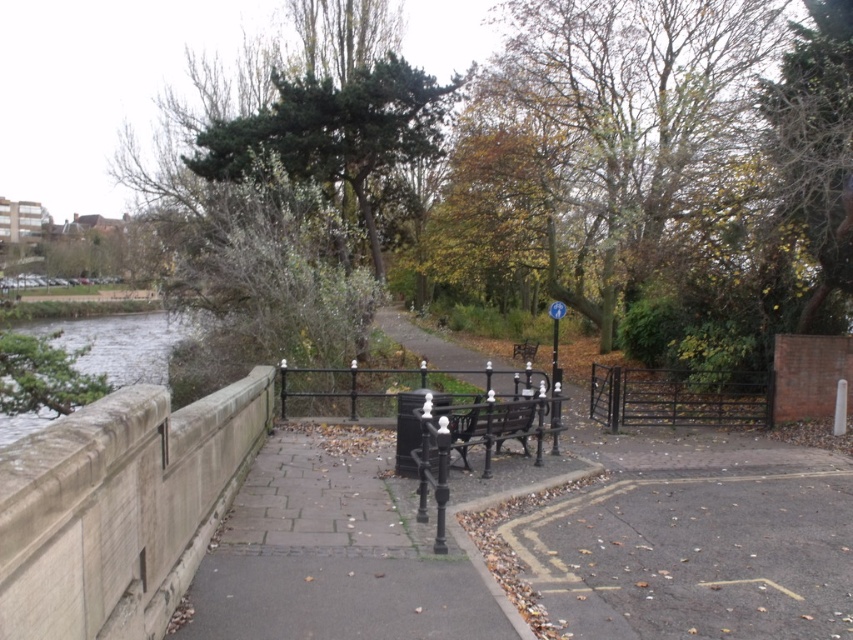
Question: Which of the following is the closest to the observer?

Choices:
 (A) (532, 164)
 (B) (534, 404)

Answer: (B)

Question: Considering the relative positions of yellow-green foliage at upper center and clear water at edge at left in the image provided, where is yellow-green foliage at upper center located with respect to clear water at edge at left?

Choices:
 (A) right
 (B) left

Answer: (A)

Question: Which is nearer to the yellow-green foliage at upper center?

Choices:
 (A) black wrought iron bench at center
 (B) clear water at edge at left

Answer: (A)

Question: Considering the relative positions of yellow-green foliage at upper center and clear water at edge at left in the image provided, where is yellow-green foliage at upper center located with respect to clear water at edge at left?

Choices:
 (A) left
 (B) right

Answer: (B)

Question: Based on their relative distances, which object is farther from the clear water at edge at left?

Choices:
 (A) black wrought iron bench at center
 (B) yellow-green foliage at upper center

Answer: (A)

Question: Is yellow-green foliage at upper center smaller than black wrought iron bench at center?

Choices:
 (A) yes
 (B) no

Answer: (B)